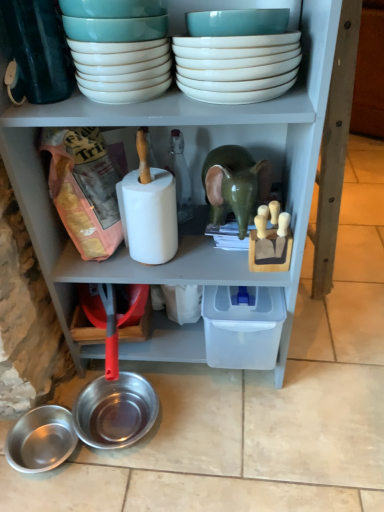
Question: Considering the relative sizes of shiny metallic bowl at lower left, acting as the third bowl starting from the top, and white glossy bowls at upper center, which is counted as the 1th bowl, starting from the top, in the image provided, is shiny metallic bowl at lower left, acting as the third bowl starting from the top, smaller than white glossy bowls at upper center, which is counted as the 1th bowl, starting from the top,?

Choices:
 (A) no
 (B) yes

Answer: (B)

Question: Does shiny metallic bowl at lower left, which ranks as the second bowl in bottom-to-top order, lie in front of white glossy bowls at upper center, which ranks as the 4th bowl in bottom-to-top order?

Choices:
 (A) yes
 (B) no

Answer: (B)

Question: Can you see shiny metallic bowl at lower left, acting as the third bowl starting from the top, touching white glossy bowls at upper center, which ranks as the 4th bowl in bottom-to-top order?

Choices:
 (A) no
 (B) yes

Answer: (A)

Question: From the image's perspective, would you say shiny metallic bowl at lower left, which ranks as the second bowl in bottom-to-top order, is positioned over white glossy bowls at upper center, which is counted as the 1th bowl, starting from the top?

Choices:
 (A) no
 (B) yes

Answer: (A)

Question: Is shiny metallic bowl at lower left, acting as the third bowl starting from the top, shorter than white glossy bowls at upper center, which ranks as the 4th bowl in bottom-to-top order?

Choices:
 (A) no
 (B) yes

Answer: (B)

Question: Does shiny metallic bowl at lower left, which ranks as the second bowl in bottom-to-top order, contain white glossy bowls at upper center, which is counted as the 1th bowl, starting from the top?

Choices:
 (A) no
 (B) yes

Answer: (A)

Question: Can we say shiny metallic bowl at lower left, arranged as the first bowl when ordered from the bottom, lies outside white glossy bowls at upper center, which ranks as the 4th bowl in bottom-to-top order?

Choices:
 (A) yes
 (B) no

Answer: (A)

Question: Would you say shiny metallic bowl at lower left, the fourth bowl viewed from the top, contains white glossy bowls at upper center, which is counted as the 1th bowl, starting from the top?

Choices:
 (A) no
 (B) yes

Answer: (A)

Question: Is shiny metallic bowl at lower left, arranged as the first bowl when ordered from the bottom, oriented away from white glossy bowls at upper center, which is counted as the 1th bowl, starting from the top?

Choices:
 (A) yes
 (B) no

Answer: (B)

Question: Does shiny metallic bowl at lower left, the fourth bowl viewed from the top, have a lesser height compared to white glossy bowls at upper center, which is counted as the 1th bowl, starting from the top?

Choices:
 (A) no
 (B) yes

Answer: (B)

Question: From the image's perspective, is shiny metallic bowl at lower left, the fourth bowl viewed from the top, below white glossy bowls at upper center, which ranks as the 4th bowl in bottom-to-top order?

Choices:
 (A) no
 (B) yes

Answer: (B)

Question: Can you confirm if shiny metallic bowl at lower left, arranged as the first bowl when ordered from the bottom, is wider than white glossy bowls at upper center, which is counted as the 1th bowl, starting from the top?

Choices:
 (A) no
 (B) yes

Answer: (A)

Question: From the image's perspective, is shiny metallic bowl at lower left, arranged as the first bowl when ordered from the bottom, on white glossy bowls at upper center, the 2th bowl viewed from the top?

Choices:
 (A) yes
 (B) no

Answer: (B)